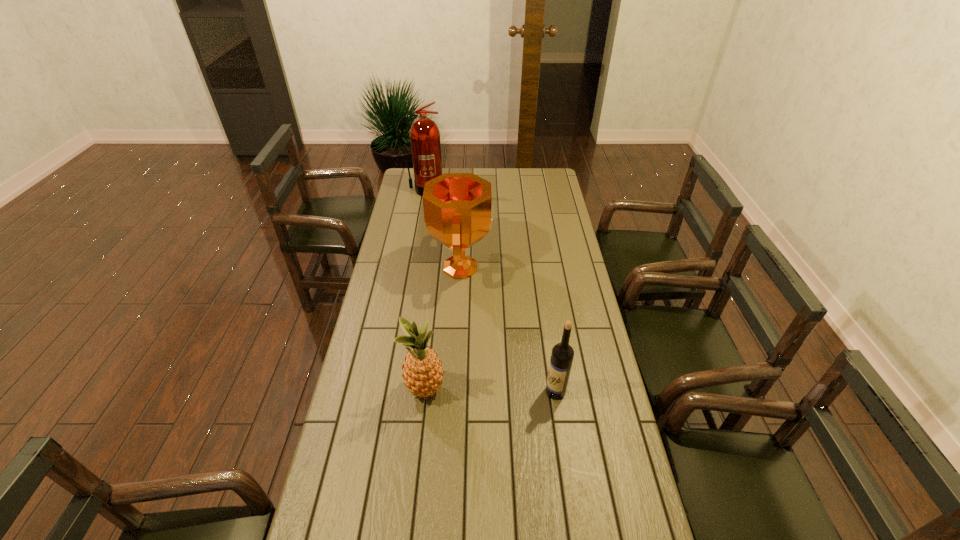
The image size is (960, 540). I want to click on free space located on the label of the wine bottle, so click(x=444, y=392).

At what (x,y) coordinates should I click in order to perform the action: click on object at the far edge. Please return your answer as a coordinate pair (x, y). This screenshot has width=960, height=540. Looking at the image, I should click on (424, 134).

The image size is (960, 540). I want to click on object situated at the left edge, so click(x=424, y=134).

In order to click on object located at the right edge in this screenshot , I will do (x=562, y=355).

I want to click on object that is positioned at the far left corner, so click(424, 134).

Where is `vacant space at the far edge of the desktop`? vacant space at the far edge of the desktop is located at coordinates (521, 174).

In the image, there is a desktop. At what (x,y) coordinates should I click in order to perform the action: click on vacant space at the left edge. Please return your answer as a coordinate pair (x, y). Looking at the image, I should click on (397, 384).

Where is `vacant position at the right edge of the desktop`? Image resolution: width=960 pixels, height=540 pixels. vacant position at the right edge of the desktop is located at coordinates (547, 221).

In the image, there is a desktop. Find the location of `vacant space at the far left corner`. vacant space at the far left corner is located at coordinates (412, 171).

Identify the location of unoccupied area between the pineapple and the wine bottle. This screenshot has height=540, width=960. (491, 391).